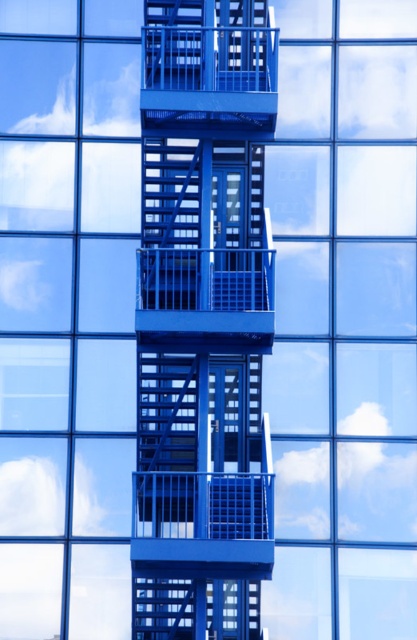
Does metallic blue fire escape at center appear on the left side of metallic blue balcony at center?

Indeed, metallic blue fire escape at center is positioned on the left side of metallic blue balcony at center.

Is point (236, 38) in front of point (228, 108)?

No, it is not.

At what (x,y) coordinates should I click in order to perform the action: click on metallic blue fire escape at center. Please return your answer as a coordinate pair (x, y). The width and height of the screenshot is (417, 640). Looking at the image, I should click on (203, 321).